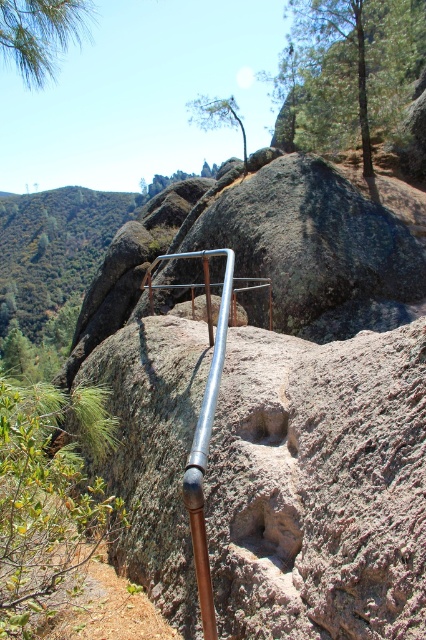
Question: Which point appears farthest from the camera in this image?

Choices:
 (A) (232, 394)
 (B) (224, 298)

Answer: (A)

Question: Among these objects, which one is nearest to the camera?

Choices:
 (A) silver metallic pipe at center
 (B) smooth granite boulder at center

Answer: (B)

Question: Where is smooth granite boulder at center located in relation to silver metallic pipe at center in the image?

Choices:
 (A) right
 (B) left

Answer: (B)

Question: Does smooth granite boulder at center have a smaller size compared to silver metallic pipe at center?

Choices:
 (A) yes
 (B) no

Answer: (B)

Question: Is smooth granite boulder at center positioned before silver metallic pipe at center?

Choices:
 (A) no
 (B) yes

Answer: (B)

Question: Which object is farther from the camera taking this photo?

Choices:
 (A) smooth granite boulder at center
 (B) silver metallic pipe at center

Answer: (B)